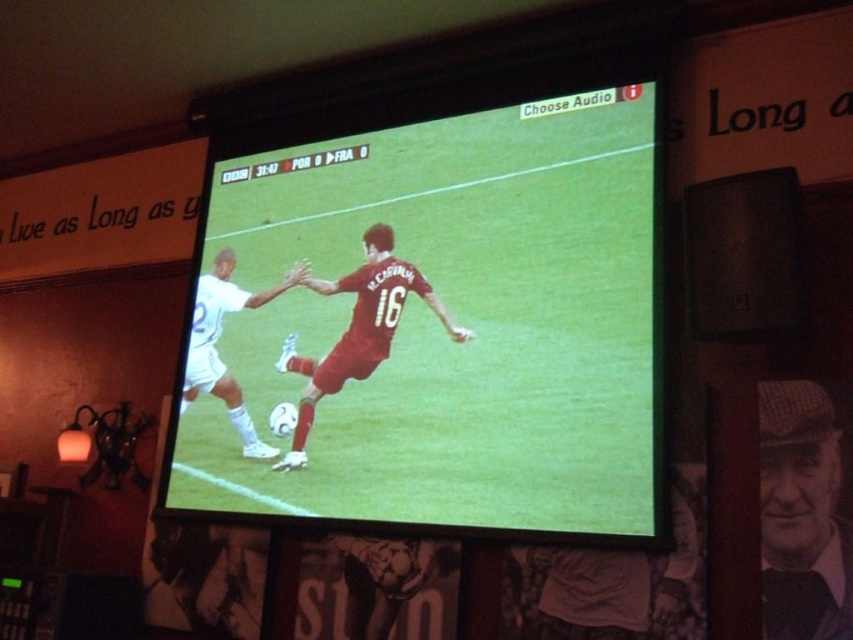
You are a soccer coach watching the game on the TV. You notice the matte red soccer ball at center and the red matte soccer player at center. Which one is located to the right of the other?

The matte red soccer ball at center is positioned on the right side of the red matte soccer player at center.

You are a soccer fan watching the match on the TV. You notice the checkered fabric cap at right and the matte red soccer ball at center. Which object is closer to the viewer?

The checkered fabric cap at right is behind the matte red soccer ball at center, so the matte red soccer ball at center is closer to the viewer.